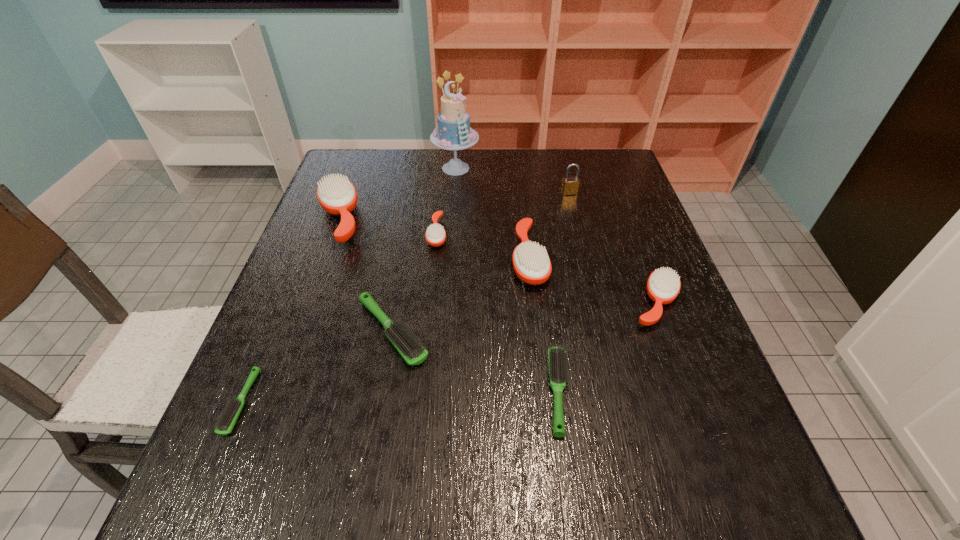
Find the location of a particular element. The width and height of the screenshot is (960, 540). light hairbrush that stands as the closest to the shortest object is located at coordinates (410, 348).

Find the location of a particular element. the second closest light hairbrush to the second smallest light hairbrush is located at coordinates (229, 415).

This screenshot has width=960, height=540. I want to click on vacant point that satisfies the following two spatial constraints: 1. with a ladder on the side of the tallest object; 2. on the left side of the second smallest light hairbrush, so click(440, 392).